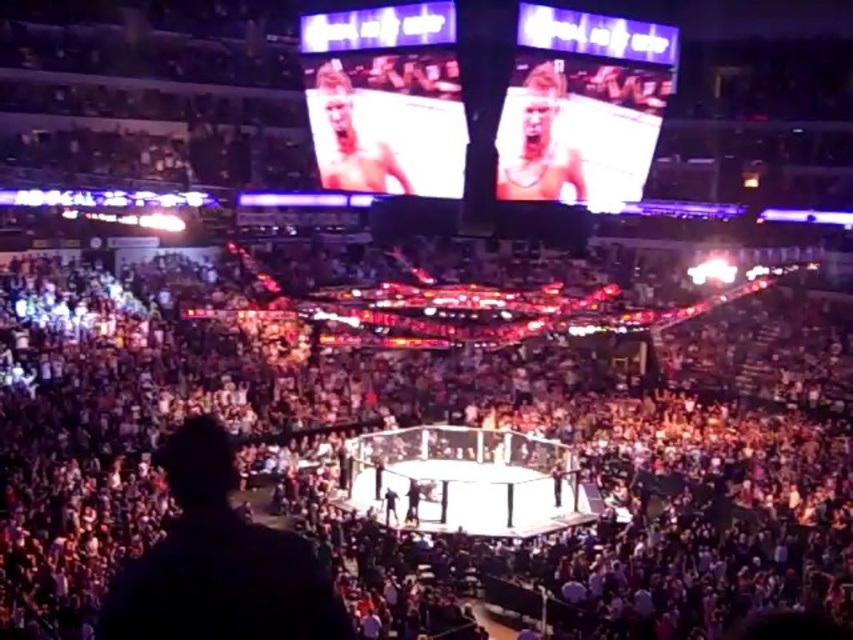
Where is `dark gray crowd at center`? The width and height of the screenshot is (853, 640). dark gray crowd at center is located at coordinates (436, 484).

Based on the photo, who is more distant from viewer, (53, 276) or (508, 120)?

The point (53, 276) is more distant.

Identify the location of dark gray crowd at center. The height and width of the screenshot is (640, 853). (436, 484).

Which is above, dark gray crowd at center or smooth skin face at upper center?

smooth skin face at upper center

Does dark gray crowd at center appear on the left side of smooth skin face at upper center?

Incorrect, dark gray crowd at center is not on the left side of smooth skin face at upper center.

You are a GUI agent. You are given a task and a screenshot of the screen. Output one action in this format:
    pyautogui.click(x=<x>, y=<y>)
    Task: Click on the dark gray crowd at center
    This screenshot has width=853, height=640.
    Given the screenshot: What is the action you would take?
    pyautogui.click(x=436, y=484)

What do you see at coordinates (537, 140) in the screenshot? The width and height of the screenshot is (853, 640). I see `smooth skin face at upper right` at bounding box center [537, 140].

Which of these two, smooth skin face at upper right or smooth skin face at upper center, stands taller?

smooth skin face at upper center is taller.

Locate an element on the screen. smooth skin face at upper right is located at coordinates (537, 140).